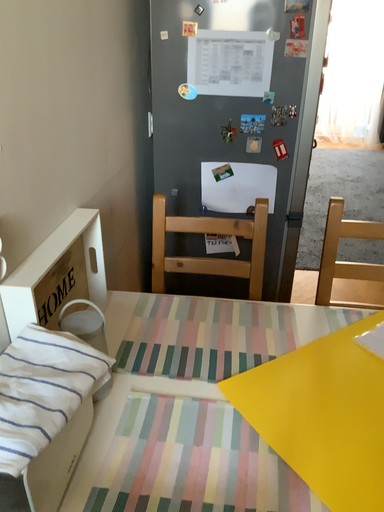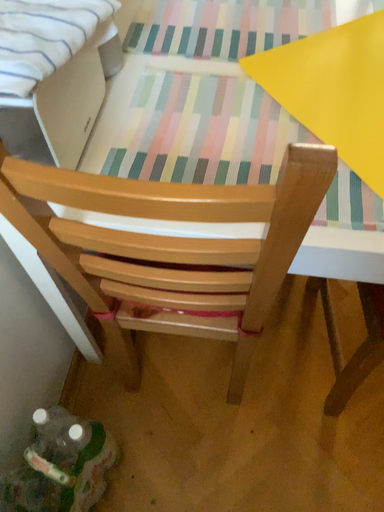
Question: Which way did the camera rotate in the video?

Choices:
 (A) rotated upward
 (B) rotated downward

Answer: (B)